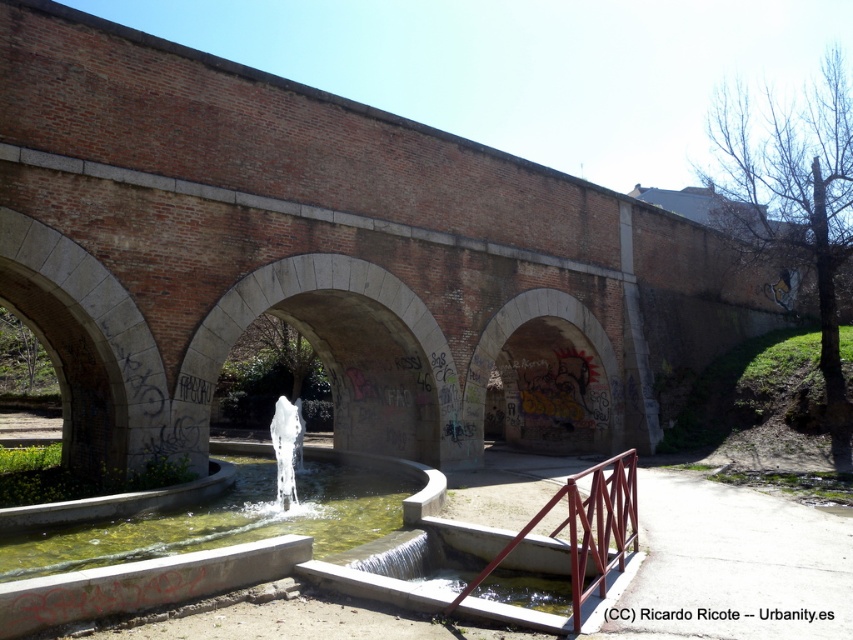
Question: Which point appears closest to the camera in this image?

Choices:
 (A) (635, 529)
 (B) (380, 496)

Answer: (A)

Question: Can you confirm if clear concrete water at center is positioned above metallic red railing at lower center?

Choices:
 (A) yes
 (B) no

Answer: (A)

Question: Is clear concrete water at center smaller than metallic red railing at lower center?

Choices:
 (A) yes
 (B) no

Answer: (A)

Question: Which point appears closest to the camera in this image?

Choices:
 (A) (625, 476)
 (B) (107, 564)

Answer: (B)

Question: Is clear concrete water at center wider than metallic red railing at lower center?

Choices:
 (A) no
 (B) yes

Answer: (A)